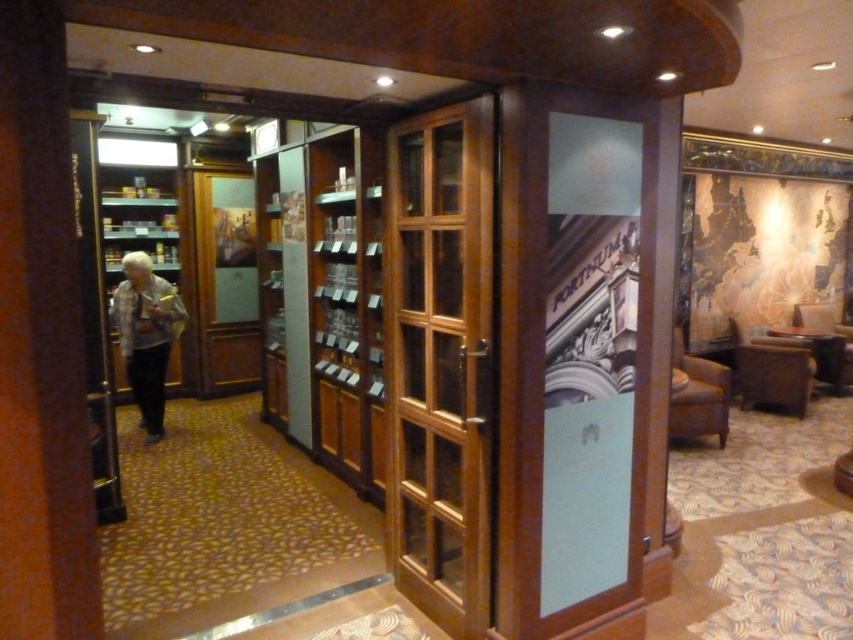
Question: Which of the following is the closest to the observer?

Choices:
 (A) (126, 316)
 (B) (433, 605)

Answer: (B)

Question: Is mahogany wood glass door at center further to the viewer compared to gray fabric jacket at left?

Choices:
 (A) yes
 (B) no

Answer: (B)

Question: Which object appears closest to the camera in this image?

Choices:
 (A) mahogany wood glass door at center
 (B) gray fabric jacket at left

Answer: (A)

Question: Is mahogany wood glass door at center further to the viewer compared to gray fabric jacket at left?

Choices:
 (A) yes
 (B) no

Answer: (B)

Question: Does mahogany wood glass door at center appear on the right side of gray fabric jacket at left?

Choices:
 (A) yes
 (B) no

Answer: (A)